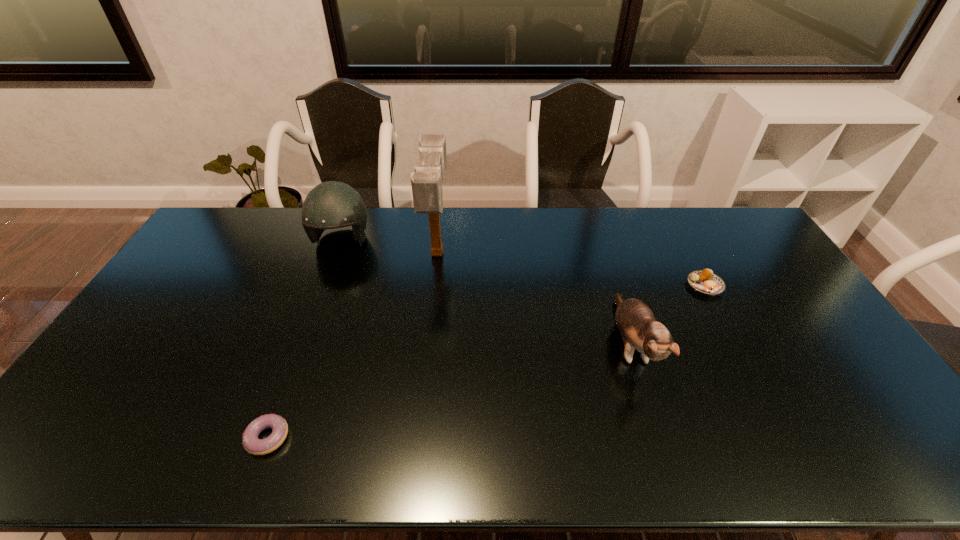
Where is `blank space located on the left of the doughnut`? The image size is (960, 540). blank space located on the left of the doughnut is located at coordinates [x=84, y=437].

At what (x,y) coordinates should I click in order to perform the action: click on mallet present at the far edge. Please return your answer as a coordinate pair (x, y). The width and height of the screenshot is (960, 540). Looking at the image, I should click on (426, 181).

Locate an element on the screen. Image resolution: width=960 pixels, height=540 pixels. football helmet present at the far edge is located at coordinates (330, 205).

Locate an element on the screen. The width and height of the screenshot is (960, 540). object located at the near edge is located at coordinates (252, 444).

The width and height of the screenshot is (960, 540). I want to click on vacant space at the far edge, so click(695, 212).

Locate an element on the screen. The width and height of the screenshot is (960, 540). free space at the near edge is located at coordinates (463, 451).

The width and height of the screenshot is (960, 540). What are the coordinates of `free space at the left edge of the desktop` in the screenshot? It's located at (181, 288).

In the image, there is a desktop. Identify the location of vacant space at the right edge. This screenshot has width=960, height=540. (833, 342).

Identify the location of vacant area at the near left corner. The image size is (960, 540). (99, 462).

The image size is (960, 540). In order to click on free space that is in between the nearest object and the football helmet in this screenshot , I will do `click(304, 339)`.